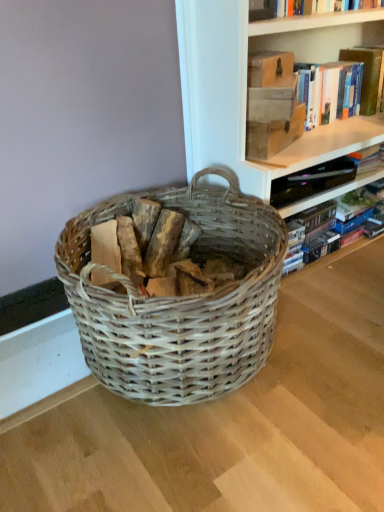
Question: Is woven wood basket at center closer to the viewer compared to matte brown book at upper right, the second paperback book in the top-to-bottom sequence?

Choices:
 (A) yes
 (B) no

Answer: (A)

Question: Does woven wood basket at center have a larger size compared to matte brown book at upper right, the 1th paperback book when ordered from bottom to top?

Choices:
 (A) no
 (B) yes

Answer: (B)

Question: Can you confirm if woven wood basket at center is taller than matte brown book at upper right, the second paperback book in the top-to-bottom sequence?

Choices:
 (A) no
 (B) yes

Answer: (B)

Question: Is woven wood basket at center in contact with matte brown book at upper right, the 1th paperback book when ordered from bottom to top?

Choices:
 (A) no
 (B) yes

Answer: (A)

Question: From a real-world perspective, is woven wood basket at center under matte brown book at upper right, the 1th paperback book when ordered from bottom to top?

Choices:
 (A) yes
 (B) no

Answer: (A)

Question: From a real-world perspective, is woven wood basket at center on matte brown book at upper right, the second paperback book in the top-to-bottom sequence?

Choices:
 (A) no
 (B) yes

Answer: (A)

Question: Can you confirm if hardcover book at upper right, which is the 2th book from top to bottom, is taller than matte brown book at upper right, the second paperback book in the top-to-bottom sequence?

Choices:
 (A) yes
 (B) no

Answer: (A)

Question: Is hardcover book at upper right, placed as the first book when sorted from bottom to top, smaller than matte brown book at upper right, the second paperback book in the top-to-bottom sequence?

Choices:
 (A) yes
 (B) no

Answer: (B)

Question: Is hardcover book at upper right, placed as the first book when sorted from bottom to top, oriented away from matte brown book at upper right, the 1th paperback book when ordered from bottom to top?

Choices:
 (A) no
 (B) yes

Answer: (A)

Question: From a real-world perspective, is hardcover book at upper right, which is the 2th book from top to bottom, under matte brown book at upper right, the second paperback book in the top-to-bottom sequence?

Choices:
 (A) no
 (B) yes

Answer: (B)

Question: Is the position of hardcover book at upper right, which is the 2th book from top to bottom, less distant than that of matte brown book at upper right, the 1th paperback book when ordered from bottom to top?

Choices:
 (A) no
 (B) yes

Answer: (A)

Question: Does hardcover book at upper right, which is the 2th book from top to bottom, have a lesser width compared to matte brown book at upper right, the 1th paperback book when ordered from bottom to top?

Choices:
 (A) yes
 (B) no

Answer: (B)

Question: Does wooden logs at center appear on the left side of hardcover book at upper right, placed as the first book when sorted from bottom to top?

Choices:
 (A) yes
 (B) no

Answer: (A)